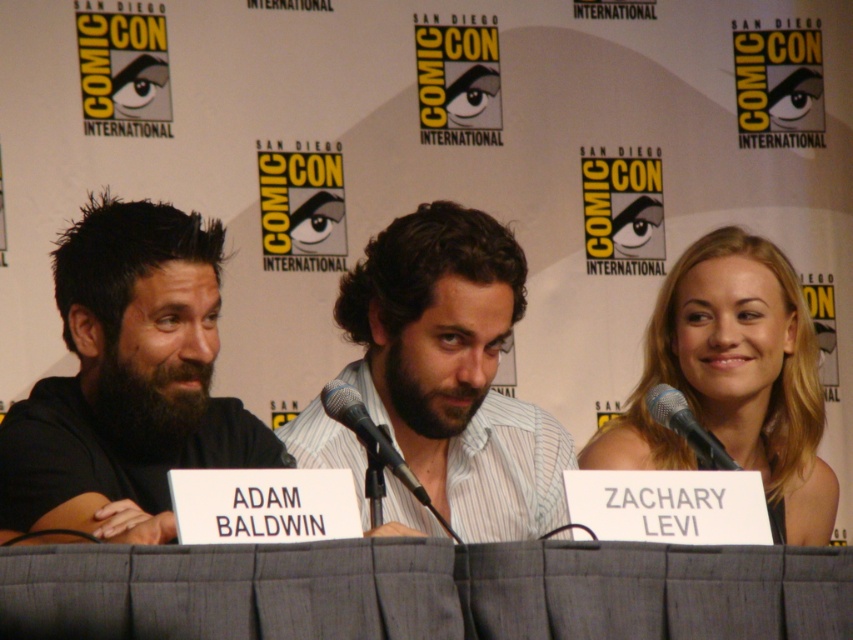
Question: Which point is farther to the camera?

Choices:
 (A) silver metallic microphone at center
 (B) dark brown hair at left

Answer: (A)

Question: Does dark brown hair at left have a greater width compared to blonde hair at right?

Choices:
 (A) yes
 (B) no

Answer: (B)

Question: Which is nearer to the silver metallic microphone at center?

Choices:
 (A) dark brown hair at left
 (B) blonde hair at right
 (C) black metallic microphone at center

Answer: (C)

Question: Is gray pleated fabric at center thinner than blonde hair at right?

Choices:
 (A) no
 (B) yes

Answer: (A)

Question: Can you confirm if gray pleated fabric at center is positioned to the right of black metallic microphone at center?

Choices:
 (A) no
 (B) yes

Answer: (B)

Question: Estimate the real-world distances between objects in this image. Which object is closer to the dark brown hair at left?

Choices:
 (A) gray pleated fabric at center
 (B) silver metallic microphone at center
 (C) blonde hair at right
 (D) light blue striped shirt at center

Answer: (D)